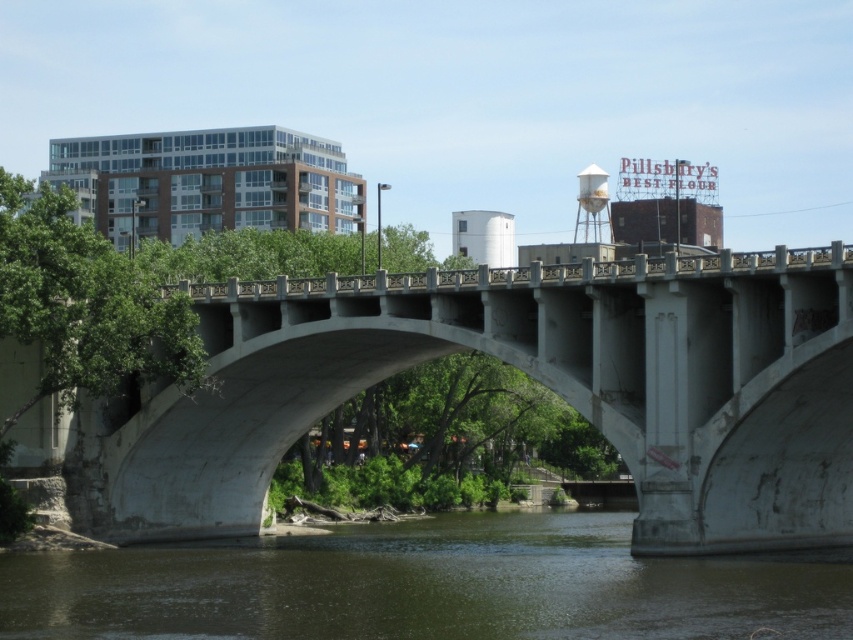
Question: Does brown murky water at lower center appear on the left side of white matte water tower at upper center?

Choices:
 (A) no
 (B) yes

Answer: (B)

Question: Does brown murky water at lower center have a lesser width compared to white matte water tower at upper center?

Choices:
 (A) no
 (B) yes

Answer: (A)

Question: Which object is positioned closest to the white matte water tower at upper center?

Choices:
 (A) brown murky water at lower center
 (B) white concrete bridge at center

Answer: (A)

Question: Estimate the real-world distances between objects in this image. Which object is closer to the white matte water tower at upper center?

Choices:
 (A) brown murky water at lower center
 (B) white concrete bridge at center

Answer: (A)

Question: Which of the following is the farthest from the observer?

Choices:
 (A) white matte water tower at upper center
 (B) brown murky water at lower center
 (C) white concrete bridge at center

Answer: (A)

Question: Is white concrete bridge at center above brown murky water at lower center?

Choices:
 (A) no
 (B) yes

Answer: (B)